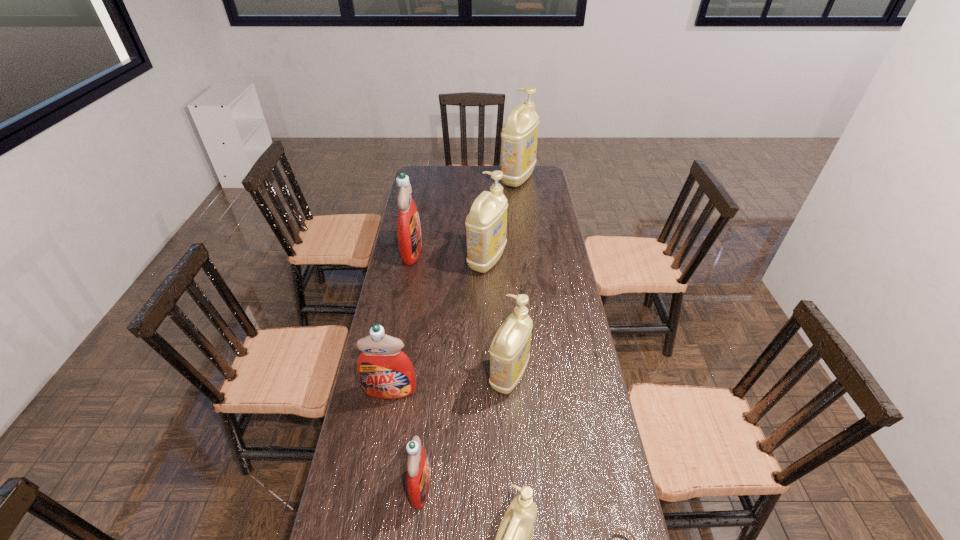
Locate an element on the screen. This screenshot has height=540, width=960. the tallest object is located at coordinates (519, 135).

Locate an element on the screen. The width and height of the screenshot is (960, 540). the farthest beige detergent is located at coordinates pyautogui.click(x=519, y=135).

At what (x,y) coordinates should I click in order to perform the action: click on the third nearest beige detergent. Please return your answer as a coordinate pair (x, y). Image resolution: width=960 pixels, height=540 pixels. Looking at the image, I should click on (486, 224).

This screenshot has height=540, width=960. In order to click on the farthest red detergent in this screenshot , I will do `click(409, 236)`.

Where is `the third biggest beige detergent`? the third biggest beige detergent is located at coordinates (509, 353).

Locate an element on the screen. the second biggest red detergent is located at coordinates (385, 372).

The width and height of the screenshot is (960, 540). I want to click on the third object from left to right, so click(418, 470).

This screenshot has width=960, height=540. What are the coordinates of `the rightmost red detergent` in the screenshot? It's located at (418, 470).

Where is `vacant space located on the front of the farthest beige detergent`? This screenshot has width=960, height=540. vacant space located on the front of the farthest beige detergent is located at coordinates tap(520, 198).

This screenshot has width=960, height=540. I want to click on free space located on the front of the third smallest beige detergent, so click(x=489, y=354).